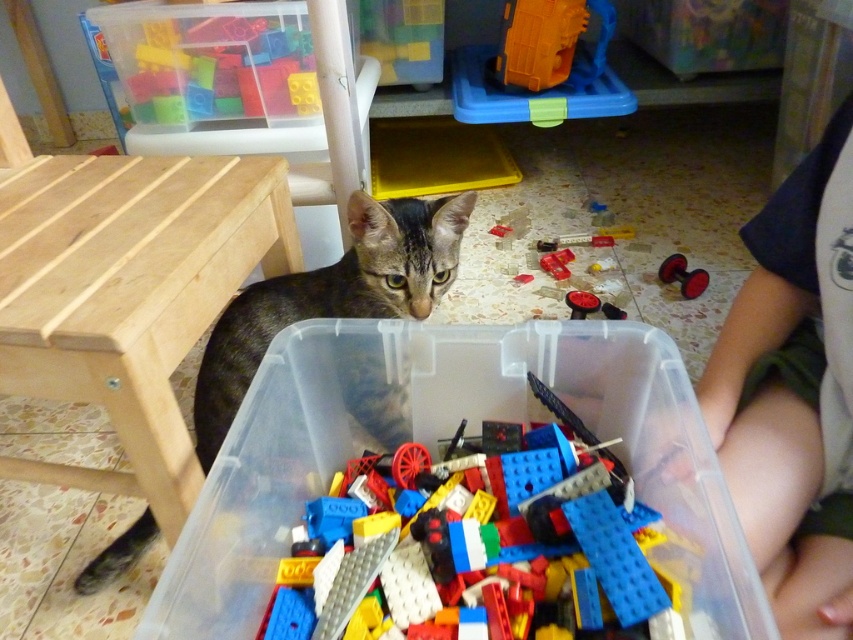
You are a child who wants to sit on the bare wood stool at left to play with the colorful building blocks. Considering the stool is only 24.97 inches away from where you are standing, can you easily reach it without moving your feet?

The bare wood stool at left is 24.97 inches away from the camera, so yes, a child can easily reach it without moving their feet since the distance is within a comfortable reach.

You are a child trying to place the orange plastic toy at upper center into the translucent plastic container at lower center. Can you fit the toy inside the container based on their sizes?

The translucent plastic container at lower center might be wider than orange plastic toy at upper center, so there is a possibility that the orange plastic toy at upper center can fit inside the container.

You are organizing a playroom and need to place the translucent plastic container at lower center and the orange plastic toy at upper center on a shelf. The shelf has limited space. Which item should you place first to ensure both fit without overlapping?

The translucent plastic container at lower center is larger in size than the orange plastic toy at upper center, so you should place the larger container first to accommodate both items on the shelf.